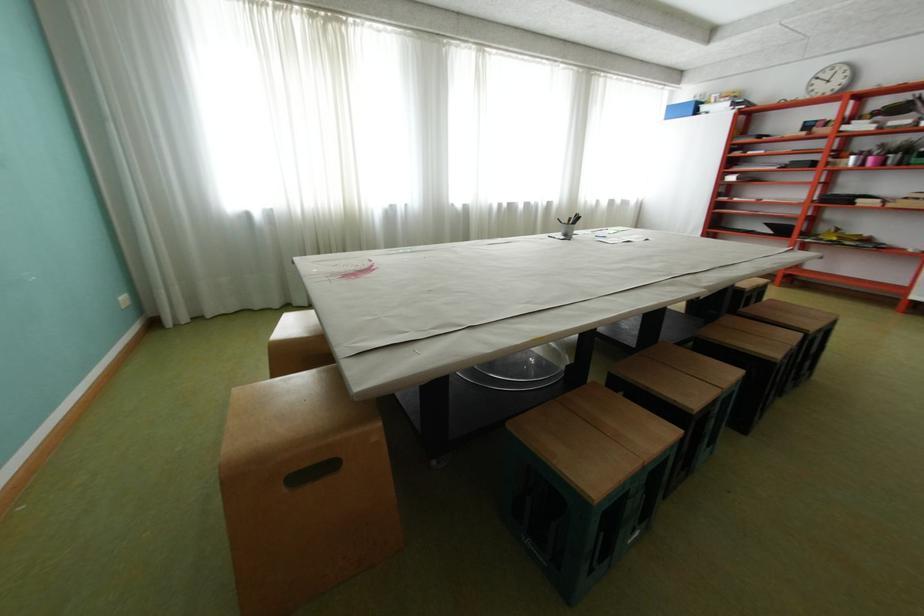
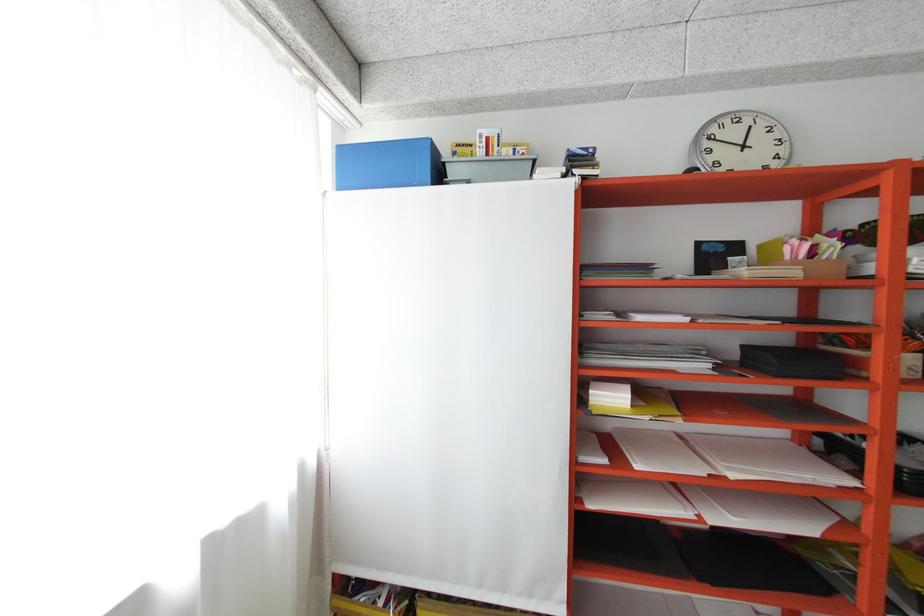
Where in the second image is the point corresponding to (x=712, y=108) from the first image?

(460, 172)